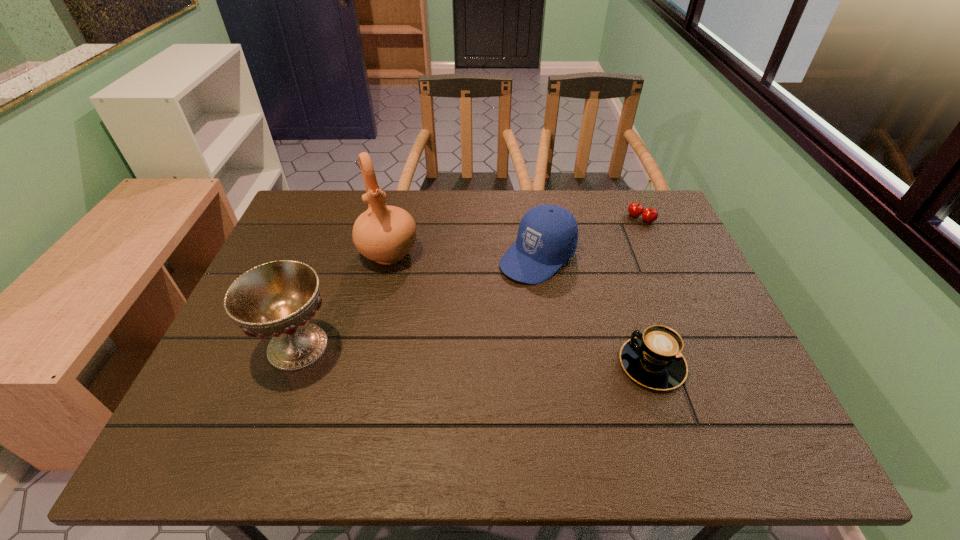
Find the location of `free space located 0.270m with the stems of the farthest object pointing upwards`. free space located 0.270m with the stems of the farthest object pointing upwards is located at coordinates (591, 269).

This screenshot has height=540, width=960. Find the location of `free region located with the stems of the farthest object pointing upwards`. free region located with the stems of the farthest object pointing upwards is located at coordinates (604, 256).

Find the location of a particular element. This screenshot has width=960, height=540. free space located on the spout of the tallest object is located at coordinates (417, 338).

The image size is (960, 540). I want to click on free space located on the spout of the tallest object, so click(404, 300).

At what (x,y) coordinates should I click in order to perform the action: click on vacant area located on the spout of the tallest object. Please return your answer as a coordinate pair (x, y). This screenshot has width=960, height=540. Looking at the image, I should click on (420, 348).

You are a GUI agent. You are given a task and a screenshot of the screen. Output one action in this format:
    pyautogui.click(x=<x>, y=<y>)
    Task: Click on the vacant region located 0.160m on the front-facing side of the third object from right to left
    Image resolution: width=960 pixels, height=540 pixels.
    Given the screenshot: What is the action you would take?
    pyautogui.click(x=473, y=310)

Where is `free space located 0.130m on the front-facing side of the third object from right to left`? free space located 0.130m on the front-facing side of the third object from right to left is located at coordinates (481, 304).

Where is `free space located on the front-facing side of the third object from right to left`? The width and height of the screenshot is (960, 540). free space located on the front-facing side of the third object from right to left is located at coordinates (410, 362).

Locate an element on the screen. cherry that is at the far edge is located at coordinates (635, 209).

What are the coordinates of `pottery present at the far edge` in the screenshot? It's located at (385, 234).